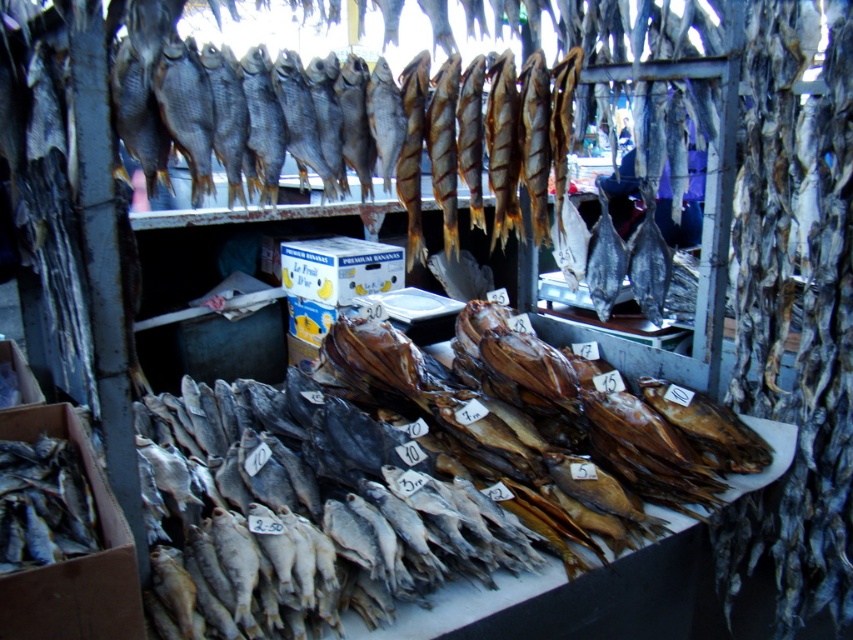
Question: Among these points, which one is farthest from the camera?

Choices:
 (A) (590, 230)
 (B) (341, 376)

Answer: (A)

Question: Does dark brown smoked fish at center have a smaller size compared to shiny silver fish at center?

Choices:
 (A) no
 (B) yes

Answer: (A)

Question: Among these points, which one is farthest from the camera?

Choices:
 (A) (666, 417)
 (B) (592, 250)

Answer: (B)

Question: Does dark brown smoked fish at center have a lesser width compared to shiny silver fish at center?

Choices:
 (A) yes
 (B) no

Answer: (B)

Question: Does dark brown smoked fish at center come behind shiny silver fish at center?

Choices:
 (A) no
 (B) yes

Answer: (A)